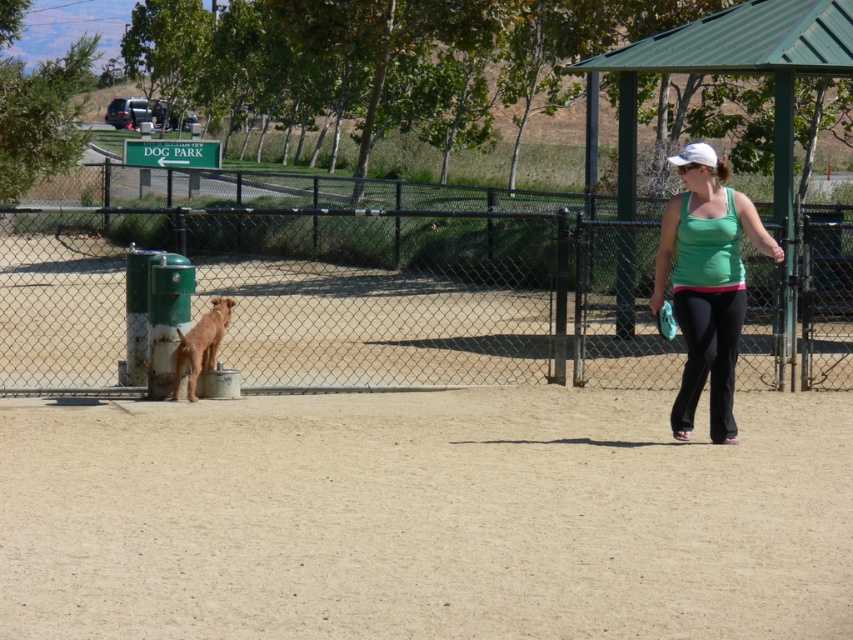
From the picture: Is green fabric tank top at right thinner than brown fur dog at center?

No.

Does green fabric tank top at right have a smaller size compared to brown fur dog at center?

Incorrect, green fabric tank top at right is not smaller in size than brown fur dog at center.

Describe the element at coordinates (706, 284) in the screenshot. I see `green fabric tank top at right` at that location.

Where is `green fabric tank top at right`? Image resolution: width=853 pixels, height=640 pixels. green fabric tank top at right is located at coordinates (706, 284).

Does green chain-link fence at center have a greater height compared to brown fur dog at center?

Correct, green chain-link fence at center is much taller as brown fur dog at center.

Find the location of `green chain-link fence at center`. green chain-link fence at center is located at coordinates (340, 288).

Which is above, brown sandy dirt at center or green chain-link fence at center?

green chain-link fence at center

Who is more distant from viewer, (589,412) or (299,337)?

Positioned behind is point (299,337).

Locate an element on the screen. The width and height of the screenshot is (853, 640). brown sandy dirt at center is located at coordinates (424, 516).